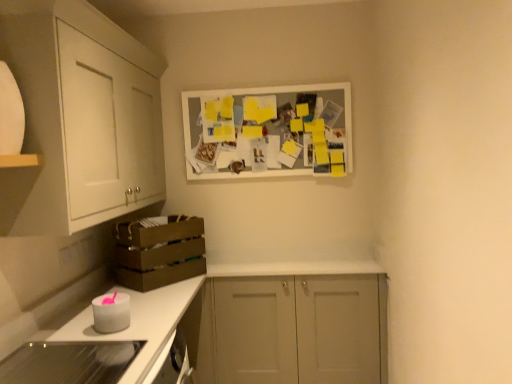
Identify the location of vacant space situated on the left part of white matte candle at lower left, which is the second appliance in front-to-back order. Image resolution: width=512 pixels, height=384 pixels. (69, 331).